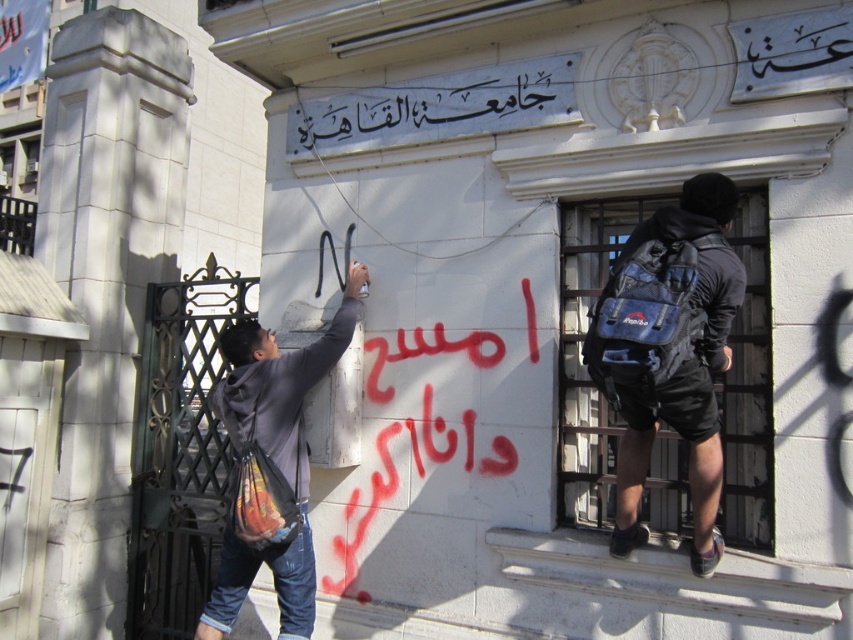
Question: Which point is farther to the camera?

Choices:
 (A) dark gray hoodie at left
 (B) dark blue backpack at right

Answer: (A)

Question: Which of the following is the farthest from the observer?

Choices:
 (A) (612, 547)
 (B) (242, 573)

Answer: (B)

Question: Considering the relative positions of dark blue backpack at right and dark gray hoodie at left in the image provided, where is dark blue backpack at right located with respect to dark gray hoodie at left?

Choices:
 (A) left
 (B) right

Answer: (B)

Question: Which of the following is the farthest from the observer?

Choices:
 (A) dark blue backpack at right
 (B) dark gray hoodie at left

Answer: (B)

Question: Can you confirm if dark blue backpack at right is positioned to the right of dark gray hoodie at left?

Choices:
 (A) no
 (B) yes

Answer: (B)

Question: Can you confirm if dark blue backpack at right is positioned to the left of dark gray hoodie at left?

Choices:
 (A) no
 (B) yes

Answer: (A)